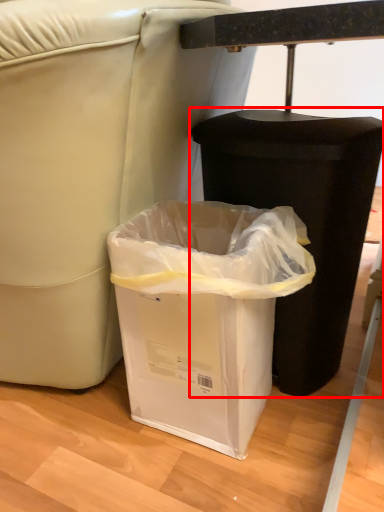
Question: From the image, what is the correct spatial relationship of waste container (annotated by the red box) in relation to waste container?

Choices:
 (A) left
 (B) right

Answer: (B)